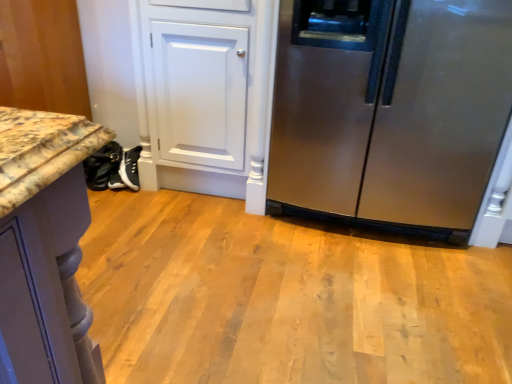
Question: Should I look upward or downward to see stainless steel refrigerator at right?

Choices:
 (A) down
 (B) up

Answer: (B)

Question: Is black leather shoes at lower left next to stainless steel refrigerator at right?

Choices:
 (A) yes
 (B) no

Answer: (B)

Question: Does black leather shoes at lower left have a smaller size compared to stainless steel refrigerator at right?

Choices:
 (A) yes
 (B) no

Answer: (A)

Question: Considering the relative positions of black leather shoes at lower left and stainless steel refrigerator at right in the image provided, is black leather shoes at lower left in front of stainless steel refrigerator at right?

Choices:
 (A) yes
 (B) no

Answer: (B)

Question: From a real-world perspective, is black leather shoes at lower left located beneath stainless steel refrigerator at right?

Choices:
 (A) yes
 (B) no

Answer: (A)

Question: Can you confirm if black leather shoes at lower left is shorter than stainless steel refrigerator at right?

Choices:
 (A) no
 (B) yes

Answer: (B)

Question: Can you confirm if black leather shoes at lower left is positioned to the left of stainless steel refrigerator at right?

Choices:
 (A) yes
 (B) no

Answer: (A)

Question: Is stainless steel refrigerator at right facing towards marble countertop at lower left?

Choices:
 (A) yes
 (B) no

Answer: (B)

Question: Does stainless steel refrigerator at right lie behind marble countertop at lower left?

Choices:
 (A) no
 (B) yes

Answer: (A)

Question: Is stainless steel refrigerator at right next to marble countertop at lower left and touching it?

Choices:
 (A) yes
 (B) no

Answer: (B)

Question: Is stainless steel refrigerator at right in front of marble countertop at lower left?

Choices:
 (A) yes
 (B) no

Answer: (A)

Question: Does stainless steel refrigerator at right have a greater height compared to marble countertop at lower left?

Choices:
 (A) yes
 (B) no

Answer: (A)

Question: Can you confirm if stainless steel refrigerator at right is bigger than marble countertop at lower left?

Choices:
 (A) no
 (B) yes

Answer: (B)

Question: From the image's perspective, is marble countertop at lower left under black leather shoes at lower left?

Choices:
 (A) no
 (B) yes

Answer: (A)